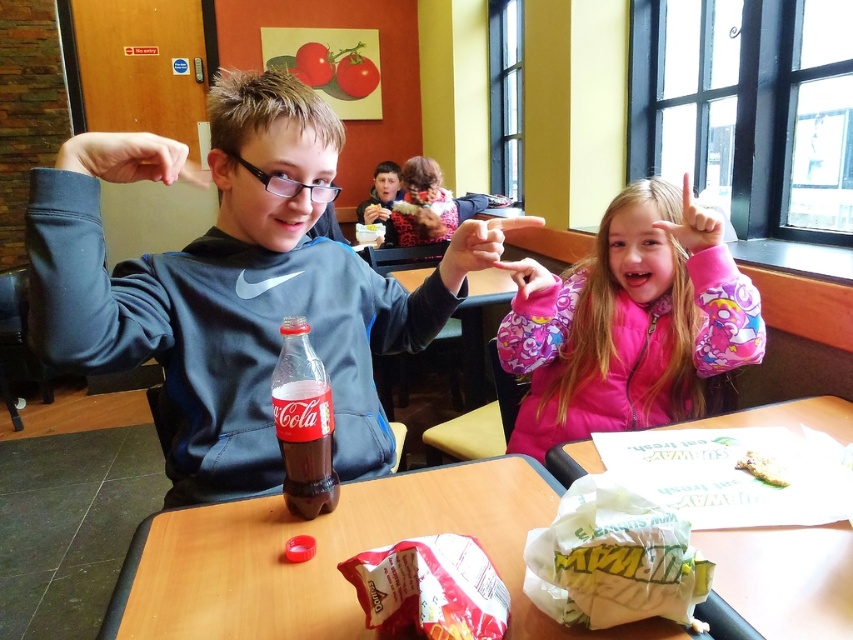
Question: Which of these objects is positioned closest to the translucent plastic coca-cola bottle at center?

Choices:
 (A) matte red bag at table center
 (B) fluffy leopard print coat at center
 (C) pink fleece jacket at center

Answer: (A)

Question: Based on their relative distances, which object is farther from the fluffy leopard print coat at center?

Choices:
 (A) white paper bag at table right
 (B) matte black hoodie at center
 (C) matte red bag at table center
 (D) pink fleece jacket at center

Answer: (C)

Question: Which of the following is the closest to the observer?

Choices:
 (A) (358, 212)
 (B) (729, 365)
 (C) (277, 140)
 (D) (409, 237)

Answer: (C)

Question: Is pink fleece jacket at center closer to camera compared to matte red bag at table center?

Choices:
 (A) yes
 (B) no

Answer: (B)

Question: Does matte black hoodie at center have a greater width compared to fluffy leopard print coat at center?

Choices:
 (A) yes
 (B) no

Answer: (A)

Question: Observing the image, what is the correct spatial positioning of green matte sandwich at center in reference to white paper napkin at upper center?

Choices:
 (A) right
 (B) left

Answer: (A)